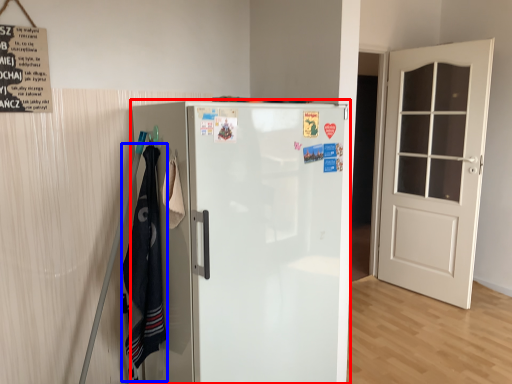
Question: Which of the following is the closest to the observer, refrigerator (highlighted by a red box) or laundry (highlighted by a blue box)?

Choices:
 (A) refrigerator
 (B) laundry

Answer: (A)